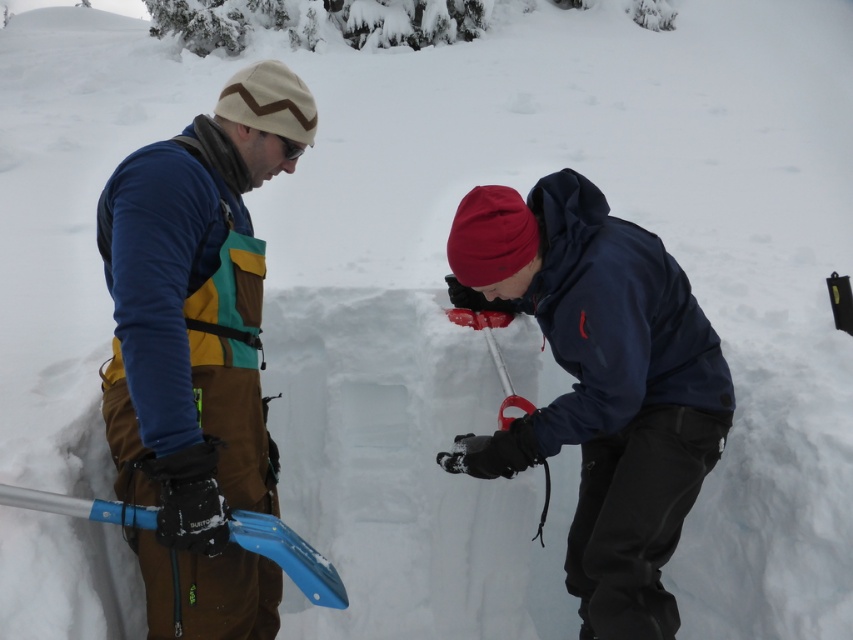
Question: Can you confirm if dark blue jacket at center is thinner than blue plastic shovel at lower left?

Choices:
 (A) no
 (B) yes

Answer: (A)

Question: Which point is closer to the camera taking this photo?

Choices:
 (A) (201, 508)
 (B) (112, 522)

Answer: (A)

Question: Does dark blue jacket at center have a lesser width compared to blue plastic shovel at lower left?

Choices:
 (A) no
 (B) yes

Answer: (A)

Question: Does matte blue snow shovel at left appear on the left side of dark blue jacket at center?

Choices:
 (A) yes
 (B) no

Answer: (A)

Question: Which object appears farthest from the camera in this image?

Choices:
 (A) dark blue jacket at center
 (B) matte blue snow shovel at left

Answer: (A)

Question: Which object appears farthest from the camera in this image?

Choices:
 (A) dark blue jacket at center
 (B) blue plastic shovel at lower left

Answer: (A)